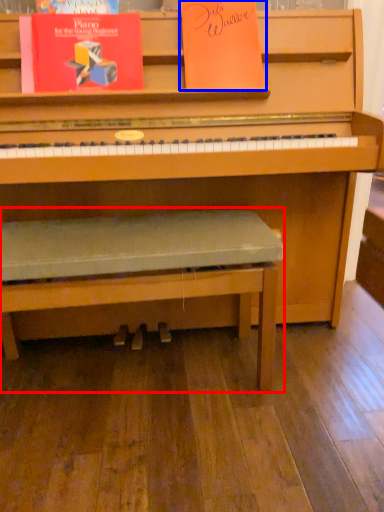
Question: Which point is further to the camera, church bench (highlighted by a red box) or paperback book (highlighted by a blue box)?

Choices:
 (A) church bench
 (B) paperback book

Answer: (B)